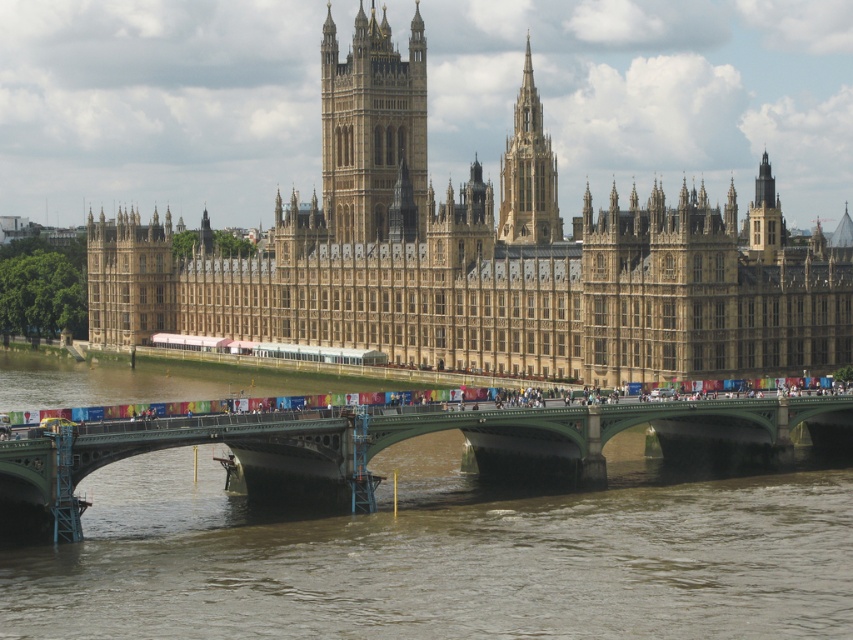
Question: Which object is the closest to the golden stone tower at center?

Choices:
 (A) golden stone spire at upper center
 (B) green metallic bridge at lower center
 (C) golden stone castle at upper center

Answer: (C)

Question: Is golden stone tower at center thinner than golden stone spire at upper center?

Choices:
 (A) no
 (B) yes

Answer: (A)

Question: Which of the following is the closest to the observer?

Choices:
 (A) golden stone tower at center
 (B) green metallic bridge at lower center
 (C) golden stone castle at upper center
 (D) golden stone spire at upper center

Answer: (B)

Question: Which object is the closest to the golden stone tower at center?

Choices:
 (A) golden stone castle at upper center
 (B) golden stone spire at upper center

Answer: (A)

Question: Does golden stone castle at upper center lie behind golden stone tower at center?

Choices:
 (A) no
 (B) yes

Answer: (A)

Question: Is the position of golden stone castle at upper center less distant than that of golden stone spire at upper center?

Choices:
 (A) yes
 (B) no

Answer: (A)